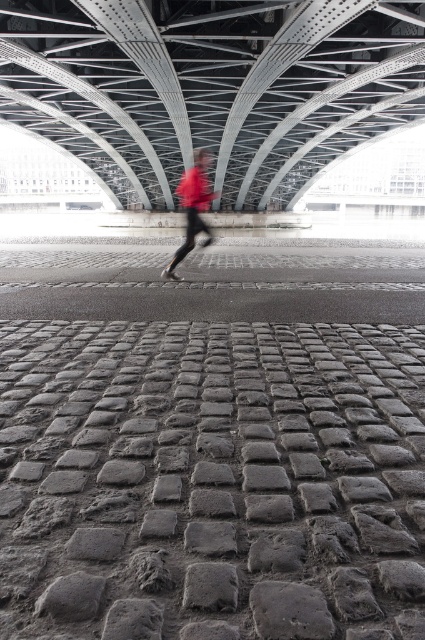
Between gray cobblestone pavement at center and metallic gray bridge at center, which one appears on the right side from the viewer's perspective?

gray cobblestone pavement at center is more to the right.

The image size is (425, 640). What are the coordinates of `gray cobblestone pavement at center` in the screenshot? It's located at (210, 480).

Is metallic gray bridge at center to the left of red fabric pants at center from the viewer's perspective?

Incorrect, metallic gray bridge at center is not on the left side of red fabric pants at center.

Does metallic gray bridge at center lie in front of red fabric pants at center?

No.

Measure the distance between metallic gray bridge at center and camera.

They are 10.60 meters apart.

At what (x,y) coordinates should I click in order to perform the action: click on metallic gray bridge at center. Please return your answer as a coordinate pair (x, y). Looking at the image, I should click on (212, 88).

In the scene shown: Is gray cobblestone pavement at center behind red fabric pants at center?

No, it is not.

Is point (306, 365) positioned after point (204, 243)?

No.

Between point (252, 403) and point (178, 250), which one is positioned behind?

Point (178, 250)

Identify the location of gray cobblestone pavement at center. (210, 480).